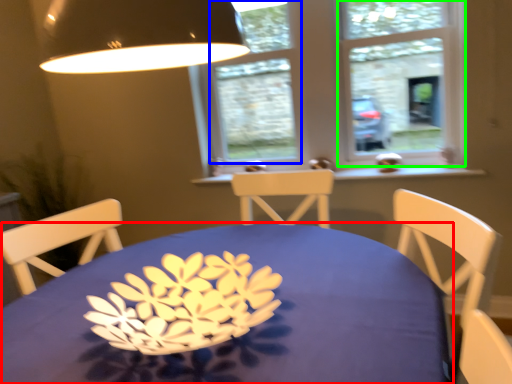
Question: Considering the real-world distances, which object is closest to table (highlighted by a red box)? window (highlighted by a blue box) or window frame (highlighted by a green box).

Choices:
 (A) window
 (B) window frame

Answer: (B)